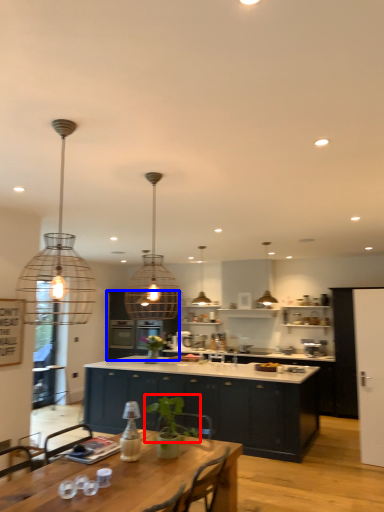
Question: Which object appears closest to the camera in this image, plant (highlighted by a red box) or cabinetry (highlighted by a blue box)?

Choices:
 (A) plant
 (B) cabinetry

Answer: (A)